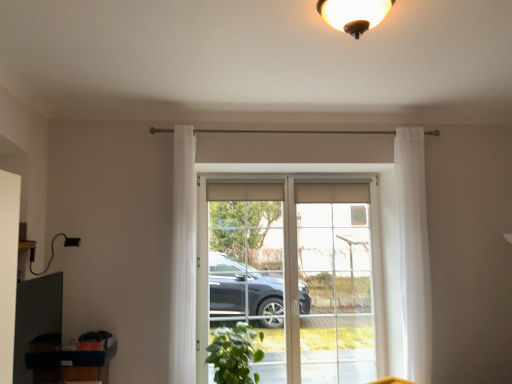
Where is `clear glass window at center`? This screenshot has height=384, width=512. clear glass window at center is located at coordinates (283, 249).

Locate an element on the screen. The height and width of the screenshot is (384, 512). lamp in front of the white sheer curtain at right, which is counted as the first curtain, starting from the right is located at coordinates (353, 14).

Could matte gold light fixture at upper center be considered to be inside white sheer curtain at right, placed as the 2th curtain when sorted from left to right?

No, white sheer curtain at right, placed as the 2th curtain when sorted from left to right, does not contain matte gold light fixture at upper center.

Could you tell me if white sheer curtain at right, placed as the 2th curtain when sorted from left to right, is facing matte gold light fixture at upper center?

No.

Can you tell me how much white sheer curtain at right, which is counted as the first curtain, starting from the right, and matte gold light fixture at upper center differ in facing direction?

0.458 degrees.

Is clear glass window at center bigger than clear glass screen door at center?

Indeed, clear glass window at center has a larger size compared to clear glass screen door at center.

Is clear glass screen door at center a part of clear glass window at center?

Yes, clear glass screen door at center is a part of clear glass window at center.

From a real-world perspective, is clear glass window at center above or below clear glass screen door at center?

Clearly, from a real-world perspective, clear glass window at center is below clear glass screen door at center.

Measure the distance between clear glass door at center and white sheer curtain at center, which ranks as the first curtain in left-to-right order.

Result: A distance of 5.35 feet exists between clear glass door at center and white sheer curtain at center, which ranks as the first curtain in left-to-right order.

Which object is wider, clear glass door at center or white sheer curtain at center, marked as the second curtain in a right-to-left arrangement?

white sheer curtain at center, marked as the second curtain in a right-to-left arrangement.

Is there a large distance between clear glass door at center and white sheer curtain at center, marked as the second curtain in a right-to-left arrangement?

Yes, clear glass door at center and white sheer curtain at center, marked as the second curtain in a right-to-left arrangement, are quite far apart.

Does clear glass door at center appear on the right side of white sheer curtain at center, marked as the second curtain in a right-to-left arrangement?

Yes, clear glass door at center is to the right of white sheer curtain at center, marked as the second curtain in a right-to-left arrangement.

Between point (357, 36) and point (364, 307), which one is positioned behind?

The point (364, 307) is farther.

Is clear glass door at center at the back of matte gold light fixture at upper center?

No, matte gold light fixture at upper center is not facing away from clear glass door at center.

Would you say clear glass door at center is part of matte gold light fixture at upper center's contents?

No.

Based on the photo, would you say white sheer curtain at center, marked as the second curtain in a right-to-left arrangement, is outside clear glass screen door at center?

Indeed, white sheer curtain at center, marked as the second curtain in a right-to-left arrangement, is completely outside clear glass screen door at center.

Looking at their sizes, would you say white sheer curtain at center, which ranks as the first curtain in left-to-right order, is wider or thinner than clear glass screen door at center?

white sheer curtain at center, which ranks as the first curtain in left-to-right order, is wider than clear glass screen door at center.

Is white sheer curtain at center, marked as the second curtain in a right-to-left arrangement, turned away from clear glass screen door at center?

No, white sheer curtain at center, marked as the second curtain in a right-to-left arrangement, is not facing the opposite direction of clear glass screen door at center.

From a real-world perspective, between green leafy plant at lower center and clear glass door at center, who is vertically lower?

From a 3D spatial view, green leafy plant at lower center is below.

You are a GUI agent. You are given a task and a screenshot of the screen. Output one action in this format:
    pyautogui.click(x=<x>, y=<y>)
    Task: Click on the houseplant located on the left of clear glass door at center
    The image size is (512, 384).
    Given the screenshot: What is the action you would take?
    pyautogui.click(x=234, y=354)

Which is closer, (248, 372) or (324, 260)?

The point (248, 372) is closer.

Which object is thinner, green leafy plant at lower center or clear glass door at center?

clear glass door at center is thinner.

Consider the image. Is matte gold light fixture at upper center far from green leafy plant at lower center?

That's right, there is a large distance between matte gold light fixture at upper center and green leafy plant at lower center.

At what (x,y) coordinates should I click in order to perform the action: click on lamp in front of the green leafy plant at lower center. Please return your answer as a coordinate pair (x, y). Image resolution: width=512 pixels, height=384 pixels. Looking at the image, I should click on (353, 14).

In the image, is matte gold light fixture at upper center positioned in front of or behind green leafy plant at lower center?

Clearly, matte gold light fixture at upper center is in front of green leafy plant at lower center.

Which point is more forward, (369, 7) or (230, 378)?

Positioned in front is point (369, 7).

Find the location of a particular element. The height and width of the screenshot is (384, 512). curtain that is the 2nd one when counting backward from the matte gold light fixture at upper center is located at coordinates tap(414, 252).

The height and width of the screenshot is (384, 512). I want to click on screen door on the left of the clear glass window at center, so click(264, 264).

Looking at the image, which one is located further to clear glass window at center, matte gold light fixture at upper center or white sheer curtain at center, marked as the second curtain in a right-to-left arrangement?

matte gold light fixture at upper center is positioned further to the anchor clear glass window at center.

Based on their spatial positions, is white sheer curtain at center, marked as the second curtain in a right-to-left arrangement, or green leafy plant at lower center closer to clear glass screen door at center?

green leafy plant at lower center.

Consider the image. Based on their spatial positions, is white sheer curtain at center, marked as the second curtain in a right-to-left arrangement, or matte gold light fixture at upper center further from clear glass window at center?

Among the two, matte gold light fixture at upper center is located further to clear glass window at center.

When comparing their distances from white sheer curtain at right, which is counted as the first curtain, starting from the right, does green leafy plant at lower center or clear glass screen door at center seem closer?

Among the two, green leafy plant at lower center is located nearer to white sheer curtain at right, which is counted as the first curtain, starting from the right.

Based on their spatial positions, is white sheer curtain at right, placed as the 2th curtain when sorted from left to right, or clear glass door at center further from green leafy plant at lower center?

white sheer curtain at right, placed as the 2th curtain when sorted from left to right, lies further to green leafy plant at lower center than the other object.

Based on their spatial positions, is matte gold light fixture at upper center or clear glass screen door at center further from white sheer curtain at right, which is counted as the first curtain, starting from the right?

Among the two, clear glass screen door at center is located further to white sheer curtain at right, which is counted as the first curtain, starting from the right.

Considering their positions, is matte gold light fixture at upper center positioned closer to white sheer curtain at right, placed as the 2th curtain when sorted from left to right, than clear glass window at center?

clear glass window at center is closer to white sheer curtain at right, placed as the 2th curtain when sorted from left to right.

From the image, which object appears to be nearer to green leafy plant at lower center, matte gold light fixture at upper center or white sheer curtain at center, marked as the second curtain in a right-to-left arrangement?

white sheer curtain at center, marked as the second curtain in a right-to-left arrangement.

Locate an element on the screen. This screenshot has height=384, width=512. window between matte gold light fixture at upper center and clear glass door at center along the z-axis is located at coordinates (283, 249).

Identify the location of window between green leafy plant at lower center and clear glass door at center. This screenshot has height=384, width=512. (283, 249).

This screenshot has width=512, height=384. What are the coordinates of `window between white sheer curtain at center, which ranks as the first curtain in left-to-right order, and green leafy plant at lower center, in the vertical direction` in the screenshot? It's located at (283, 249).

Find the location of `houseplant located between white sheer curtain at center, marked as the second curtain in a right-to-left arrangement, and clear glass door at center in the left-right direction`. houseplant located between white sheer curtain at center, marked as the second curtain in a right-to-left arrangement, and clear glass door at center in the left-right direction is located at coordinates (234, 354).